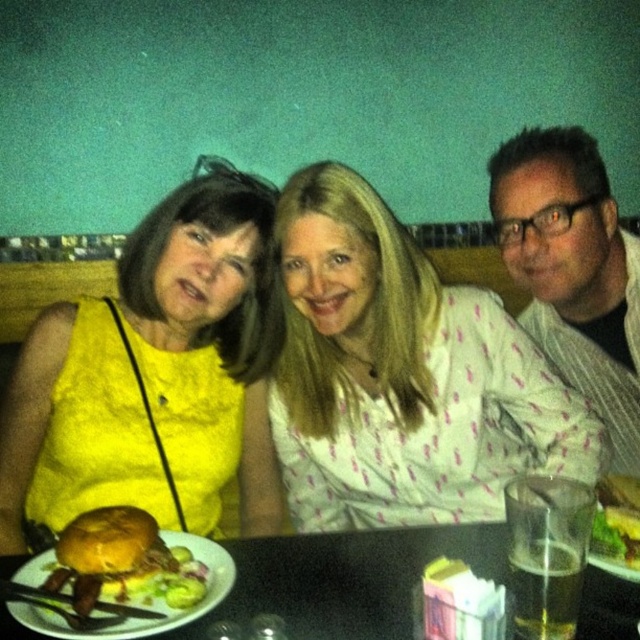
Does white dotted shirt at center have a smaller size compared to green leafy salad at lower right?

Actually, white dotted shirt at center might be larger than green leafy salad at lower right.

Does white dotted shirt at center have a larger size compared to green leafy salad at lower right?

Indeed, white dotted shirt at center has a larger size compared to green leafy salad at lower right.

Does point (586, 419) come in front of point (612, 525)?

No, it is behind (612, 525).

Where is `white dotted shirt at center`? The width and height of the screenshot is (640, 640). white dotted shirt at center is located at coordinates (403, 376).

Identify the location of satin white shirt at center. The height and width of the screenshot is (640, 640). (573, 269).

Is satin white shirt at center shorter than black plastic table at lower center?

No, satin white shirt at center is not shorter than black plastic table at lower center.

Image resolution: width=640 pixels, height=640 pixels. Describe the element at coordinates (573, 269) in the screenshot. I see `satin white shirt at center` at that location.

Identify the location of satin white shirt at center. (573, 269).

Does point (442, 438) come behind point (131, 305)?

No, (442, 438) is in front of (131, 305).

Can you confirm if white dotted shirt at center is bigger than yellow fabric dress at left?

Yes, white dotted shirt at center is bigger than yellow fabric dress at left.

You are a GUI agent. You are given a task and a screenshot of the screen. Output one action in this format:
    pyautogui.click(x=<x>, y=<y>)
    Task: Click on the white dotted shirt at center
    Image resolution: width=640 pixels, height=640 pixels.
    Given the screenshot: What is the action you would take?
    pyautogui.click(x=403, y=376)